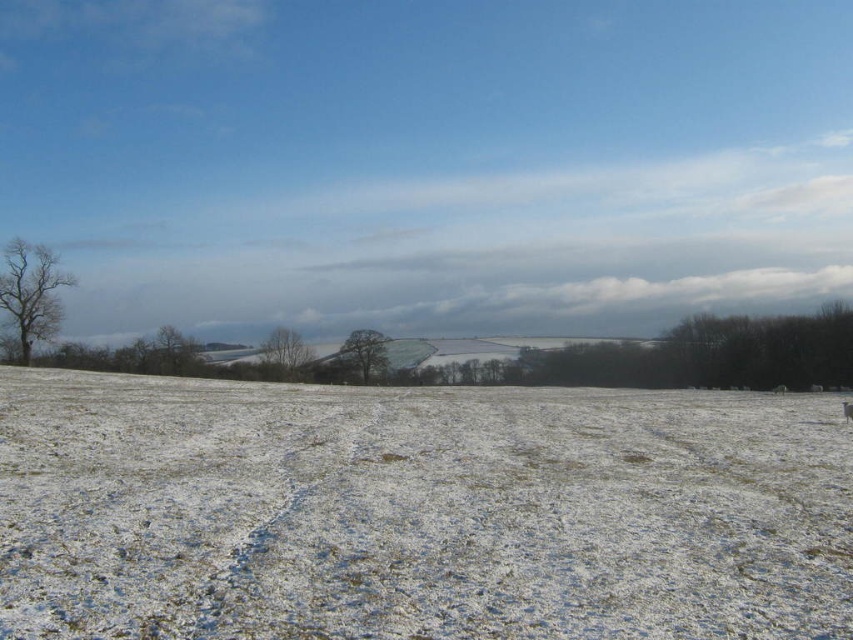
Question: Is the position of bare branches at left more distant than that of green matte tree at center?

Choices:
 (A) yes
 (B) no

Answer: (B)

Question: Which of the following is the farthest from the observer?

Choices:
 (A) green matte tree at center
 (B) bare branches at left
 (C) bare tree at center
 (D) white powdery snow at center

Answer: (C)

Question: Can you confirm if white powdery snow at center is positioned to the left of bare branches at left?

Choices:
 (A) yes
 (B) no

Answer: (B)

Question: Which is nearer to the bare branches at left?

Choices:
 (A) white powdery snow at center
 (B) bare tree at center

Answer: (B)

Question: Which point is farther to the camera?

Choices:
 (A) (381, 353)
 (B) (537, 612)
 (C) (15, 264)
 (D) (293, 348)

Answer: (D)

Question: Can you confirm if bare branches at left is smaller than green matte tree at center?

Choices:
 (A) no
 (B) yes

Answer: (B)